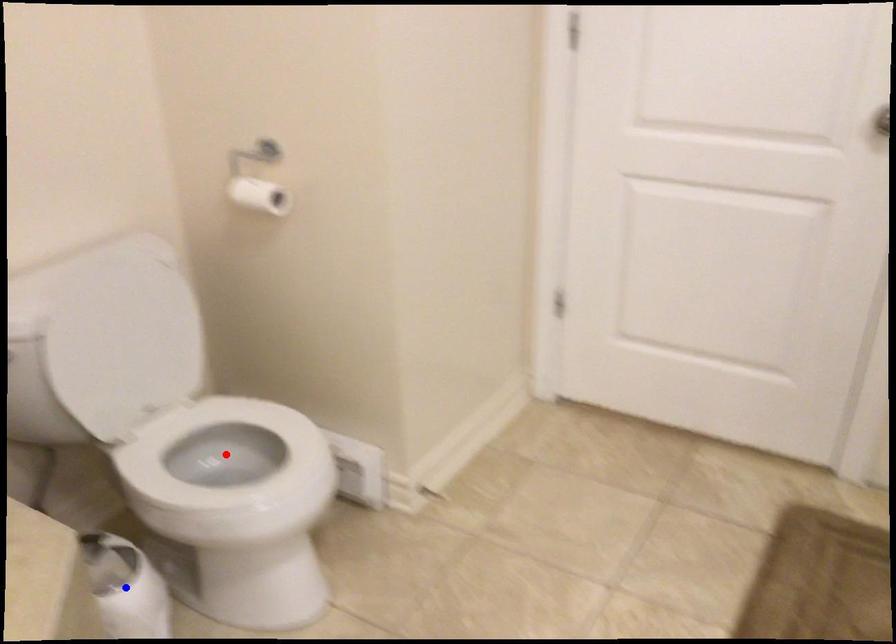
Question: Which of the two points in the image is closer to the camera?

Choices:
 (A) Blue point is closer.
 (B) Red point is closer.

Answer: (A)